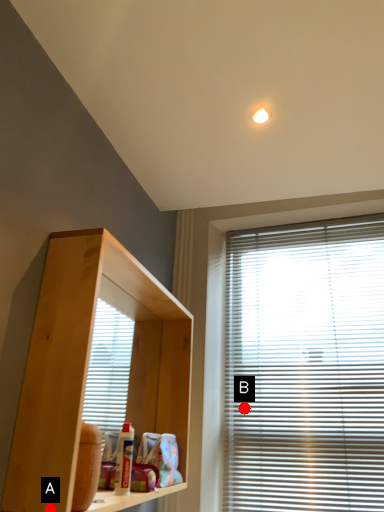
Question: Two points are circled on the image, labeled by A and B beside each circle. Which point is closer to the camera taking this photo?

Choices:
 (A) A is closer
 (B) B is closer

Answer: (A)